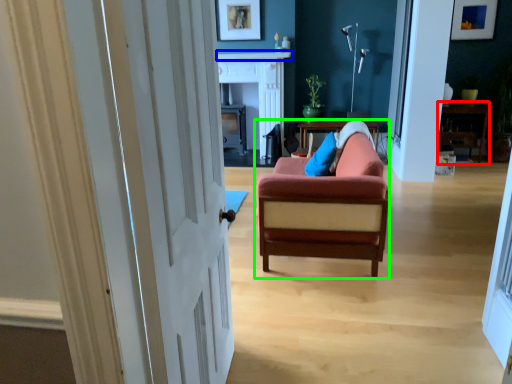
Question: Estimate the real-world distances between objects in this image. Which object is closer to table (highlighted by a red box), mantle (highlighted by a blue box) or chair (highlighted by a green box)?

Choices:
 (A) mantle
 (B) chair

Answer: (A)